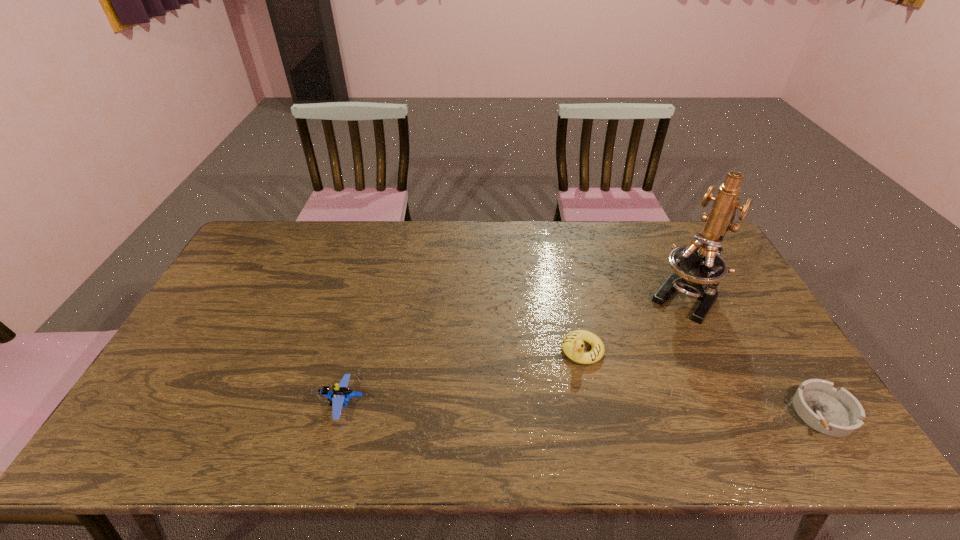
This screenshot has width=960, height=540. Find the location of `free space on the desktop that is between the Lego and the rightmost object and is positioned at the eyepiece of the second object from right to left`. free space on the desktop that is between the Lego and the rightmost object and is positioned at the eyepiece of the second object from right to left is located at coordinates (606, 408).

This screenshot has height=540, width=960. What are the coordinates of `vacant space on the desktop that is between the leftmost object and the ashtray and is positioned on the face of the second object from left to right` in the screenshot? It's located at (538, 407).